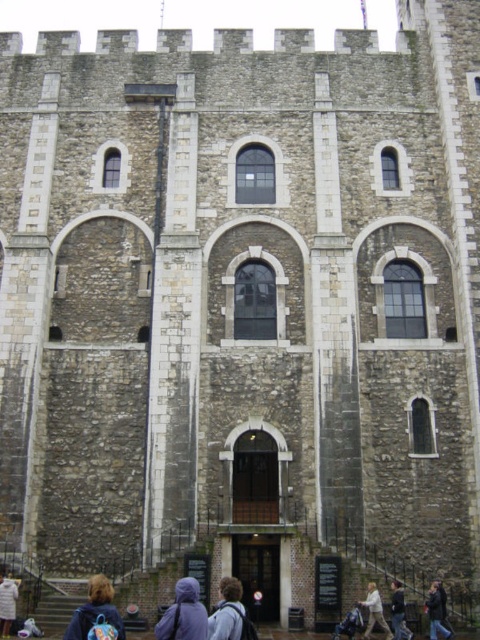
From the picture: Who is positioned more to the left, light brown wool coat at lower left or dark gray hoodie at lower center?

light brown wool coat at lower left

Between point (15, 596) and point (394, 612), which one is positioned in front?

Positioned in front is point (394, 612).

This screenshot has width=480, height=640. Identify the location of light brown wool coat at lower left. (7, 602).

Is point (444, 621) more distant than point (396, 586)?

No, it is in front of (396, 586).

Looking at this image, is dark gray jacket at lower center below dark gray hoodie at lower center?

No, dark gray jacket at lower center is not below dark gray hoodie at lower center.

Is point (430, 612) farther from viewer compared to point (393, 604)?

That is True.

Locate an element on the screen. This screenshot has width=480, height=640. dark gray jacket at lower center is located at coordinates (436, 611).

Can you confirm if light brown hair at lower center is wider than dark gray hoodie at lower center?

Correct, the width of light brown hair at lower center exceeds that of dark gray hoodie at lower center.

The image size is (480, 640). I want to click on light brown hair at lower center, so click(373, 611).

Find the location of `light brown hair at lower center`. light brown hair at lower center is located at coordinates (373, 611).